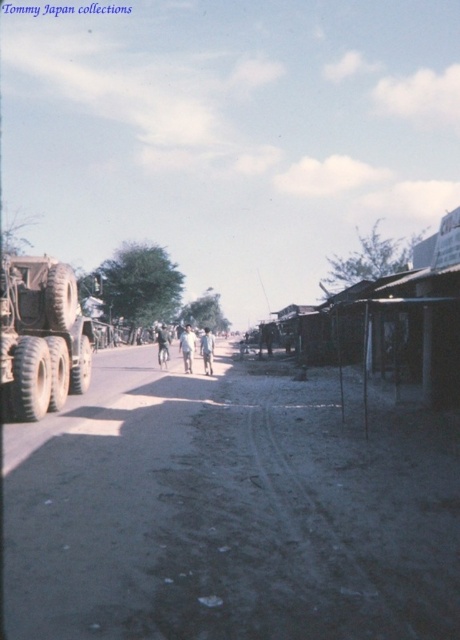
Does matte khaki truck at left have a smaller size compared to light blue denim pants at center?

Indeed, matte khaki truck at left has a smaller size compared to light blue denim pants at center.

Which is in front, point (27, 340) or point (183, 353)?

Point (27, 340) is more forward.

You are a GUI agent. You are given a task and a screenshot of the screen. Output one action in this format:
    pyautogui.click(x=<x>, y=<y>)
    Task: Click on the matte khaki truck at left
    This screenshot has height=640, width=460.
    Given the screenshot: What is the action you would take?
    pyautogui.click(x=41, y=337)

Is wooden shacks at right positioned behind light brown fabric pants at center?

No, wooden shacks at right is in front of light brown fabric pants at center.

This screenshot has height=640, width=460. What do you see at coordinates (391, 321) in the screenshot?
I see `wooden shacks at right` at bounding box center [391, 321].

Where is `wooden shacks at right`? The height and width of the screenshot is (640, 460). wooden shacks at right is located at coordinates (391, 321).

Which is behind, point (287, 440) or point (207, 369)?

Point (207, 369)

Between point (304, 500) and point (207, 362), which one is positioned behind?

The point (207, 362) is behind.

Where is `dusty gravel road at center`? dusty gravel road at center is located at coordinates (230, 513).